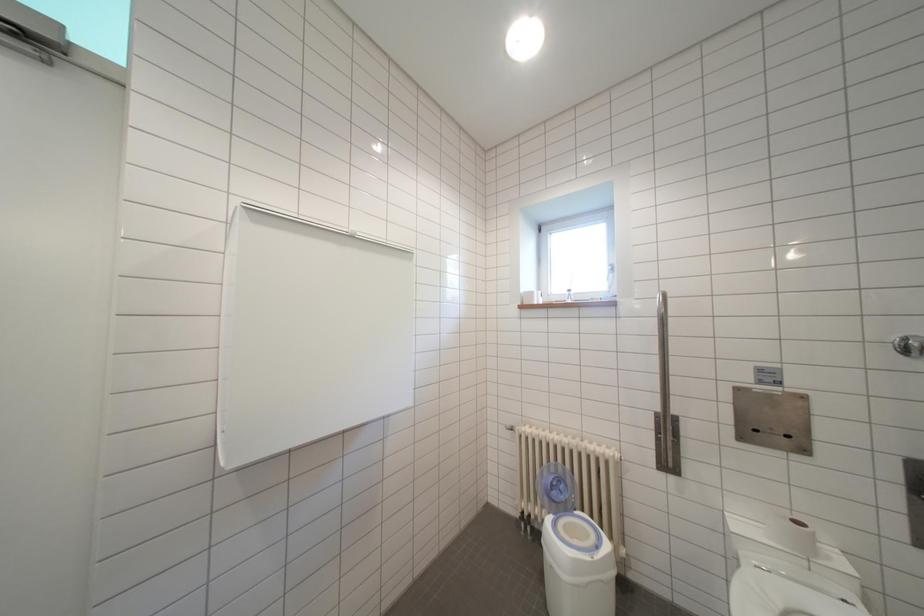
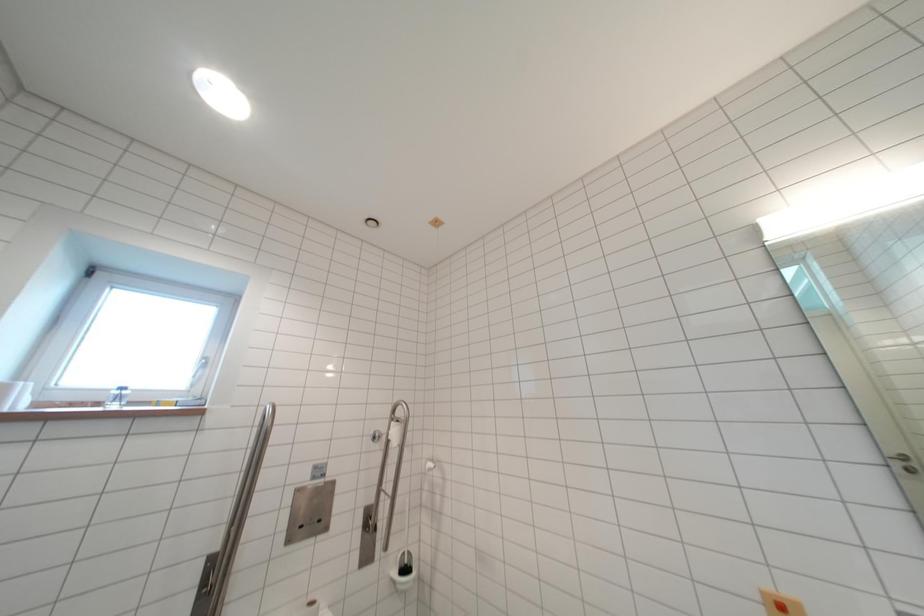
The first image is from the beginning of the video and the second image is from the end. How did the camera likely rotate when shooting the video?

The camera's rotation is toward right-up.